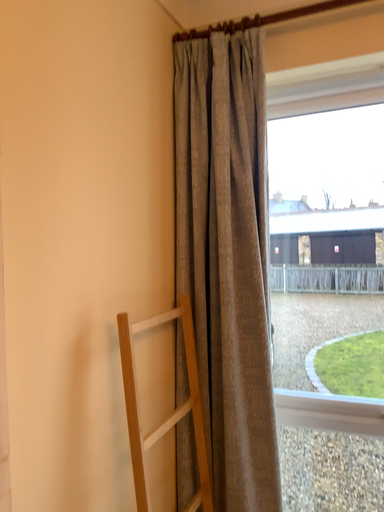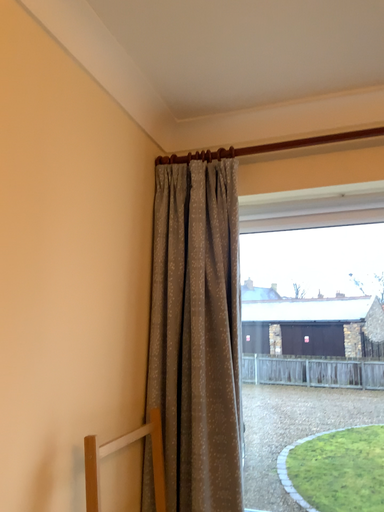
Question: Which way did the camera rotate in the video?

Choices:
 (A) rotated downward
 (B) rotated upward

Answer: (B)